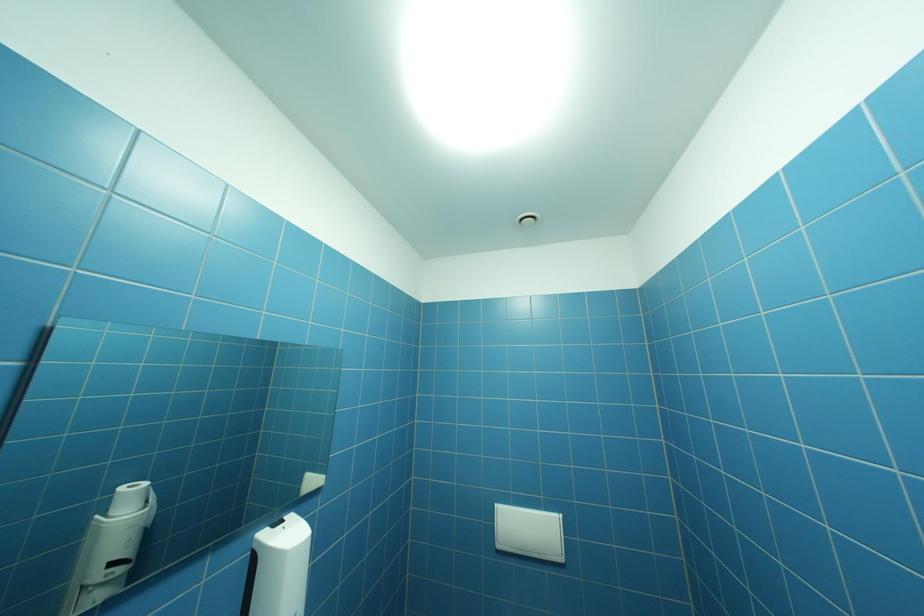
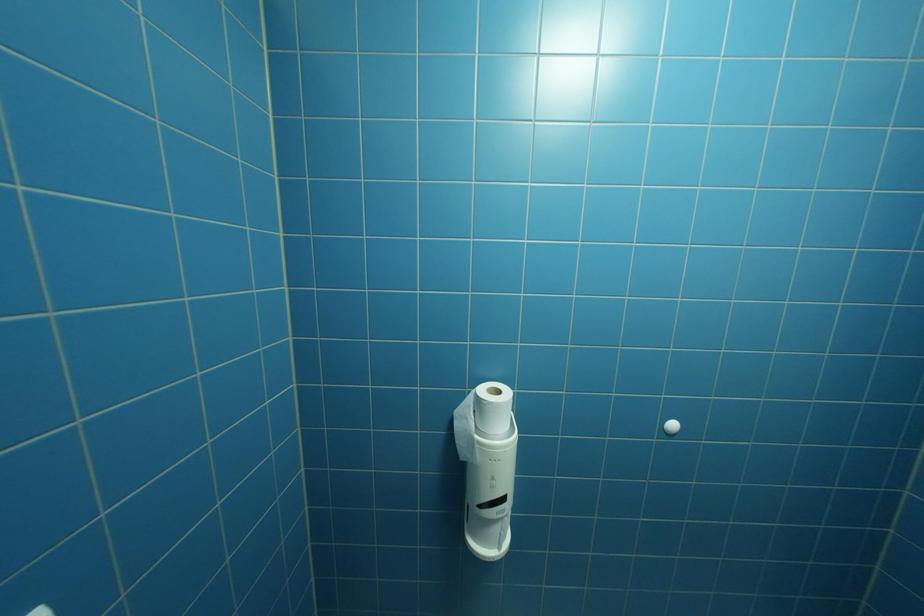
Question: The camera is either moving clockwise (left) or counter-clockwise (right) around the object. The first image is from the beginning of the video and the second image is from the end. Is the camera moving left or right when shooting the video?

Choices:
 (A) Left
 (B) Right

Answer: (A)